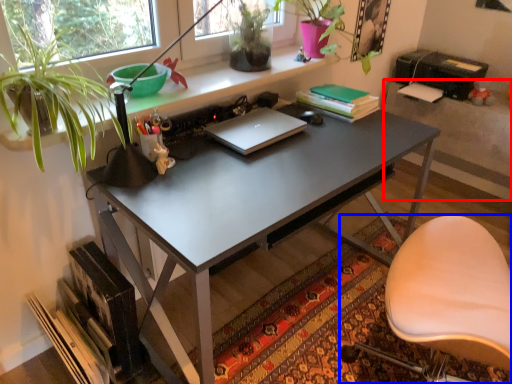
Question: Which point is further to the camera, table (highlighted by a red box) or chair (highlighted by a blue box)?

Choices:
 (A) table
 (B) chair

Answer: (A)